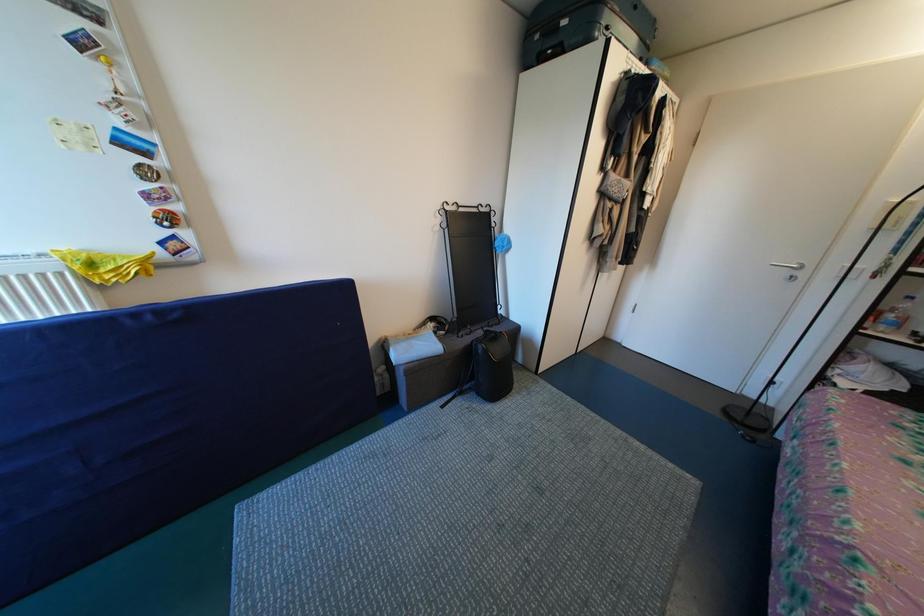
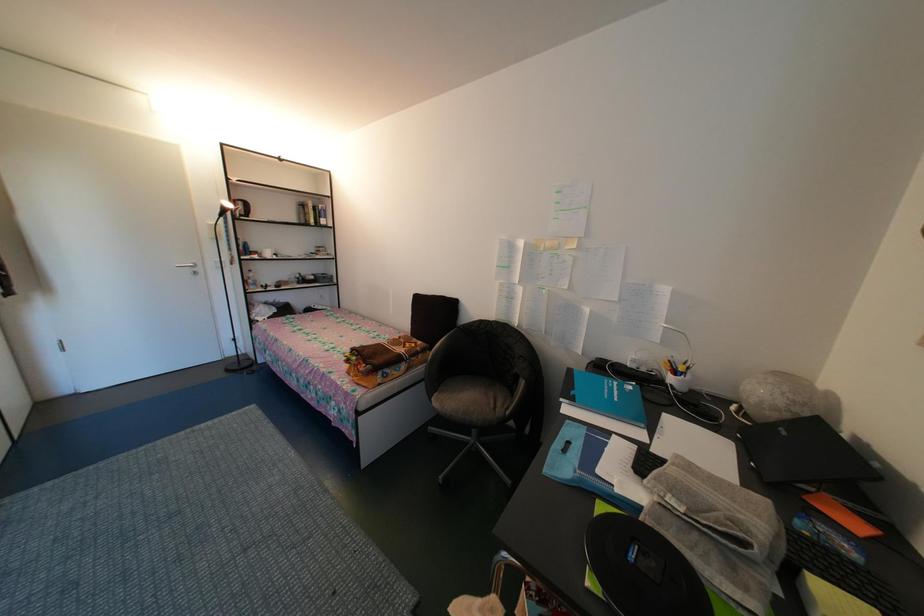
The images are taken continuously from a first-person perspective. In which direction is your viewpoint rotating?

The camera rotated toward right-down.